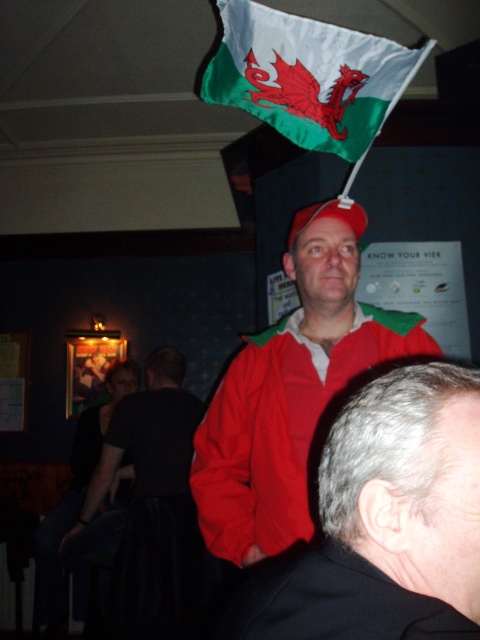
Question: Does smooth red jacket at center appear over black matte dress at lower left?

Choices:
 (A) yes
 (B) no

Answer: (A)

Question: Among these points, which one is farthest from the camera?

Choices:
 (A) (305, 88)
 (B) (457, 596)
 (C) (159, 492)
 (D) (370, 336)

Answer: (C)

Question: Among these points, which one is farthest from the camera?

Choices:
 (A) (428, 557)
 (B) (109, 480)

Answer: (B)

Question: Estimate the real-world distances between objects in this image. Which object is closer to the matte red jacket at center?

Choices:
 (A) whitematerial/textureflag at upper center
 (B) black matte dress at lower left
 (C) smooth red jacket at center

Answer: (A)

Question: Is smooth red jacket at center further to camera compared to matte red jacket at center?

Choices:
 (A) yes
 (B) no

Answer: (B)

Question: Considering the relative positions of smooth red jacket at center and whitematerial/textureflag at upper center in the image provided, where is smooth red jacket at center located with respect to whitematerial/textureflag at upper center?

Choices:
 (A) right
 (B) left

Answer: (A)